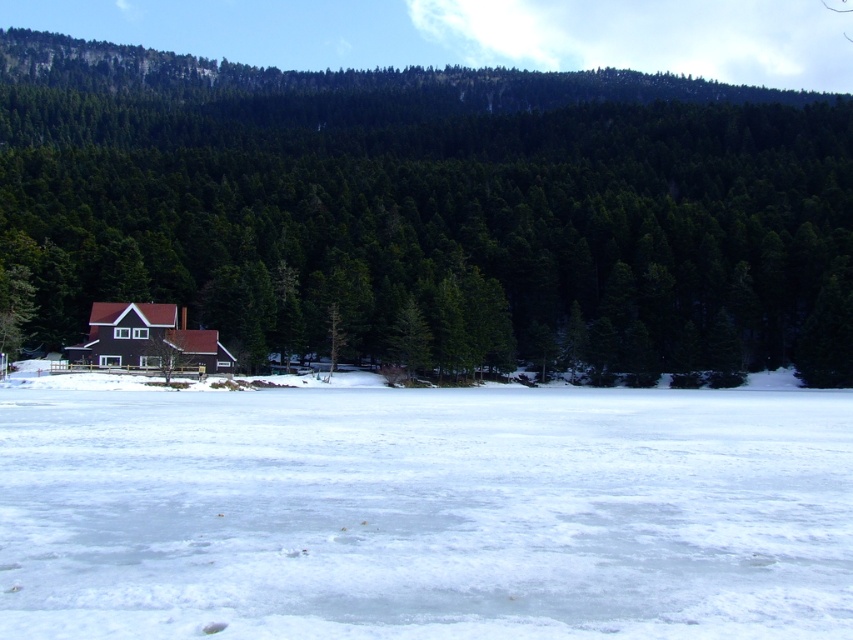
Can you confirm if white matte snow at center is wider than brown matte cabin at center?

Indeed, white matte snow at center has a greater width compared to brown matte cabin at center.

Does white matte snow at center have a larger size compared to brown matte cabin at center?

Indeed, white matte snow at center has a larger size compared to brown matte cabin at center.

Does point (228, 609) come behind point (180, 332)?

No, (228, 609) is closer to viewer.

You are a GUI agent. You are given a task and a screenshot of the screen. Output one action in this format:
    pyautogui.click(x=<x>, y=<y>)
    Task: Click on the white matte snow at center
    This screenshot has width=853, height=640.
    Given the screenshot: What is the action you would take?
    pyautogui.click(x=425, y=513)

Consider the image. Which is more to the right, green matte tree at center or brown matte cabin at center?

green matte tree at center is more to the right.

Which of these two, green matte tree at center or brown matte cabin at center, stands taller?

A: Standing taller between the two is green matte tree at center.

This screenshot has height=640, width=853. What are the coordinates of `green matte tree at center` in the screenshot? It's located at (431, 211).

What are the coordinates of `green matte tree at center` in the screenshot? It's located at (431, 211).

Which of these two, green matte tree at center or white matte snow at center, stands taller?

green matte tree at center is taller.

Is green matte tree at center to the right of white matte snow at center from the viewer's perspective?

Yes, green matte tree at center is to the right of white matte snow at center.

Identify the location of green matte tree at center. (x=431, y=211).

Where is `green matte tree at center`? This screenshot has height=640, width=853. green matte tree at center is located at coordinates (431, 211).